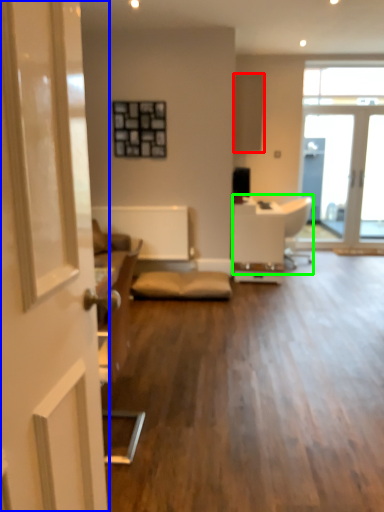
Question: Which object is the farthest from cabinetry (highlighted by a red box)? Choose among these: door (highlighted by a blue box) or armchair (highlighted by a green box).

Choices:
 (A) door
 (B) armchair

Answer: (A)